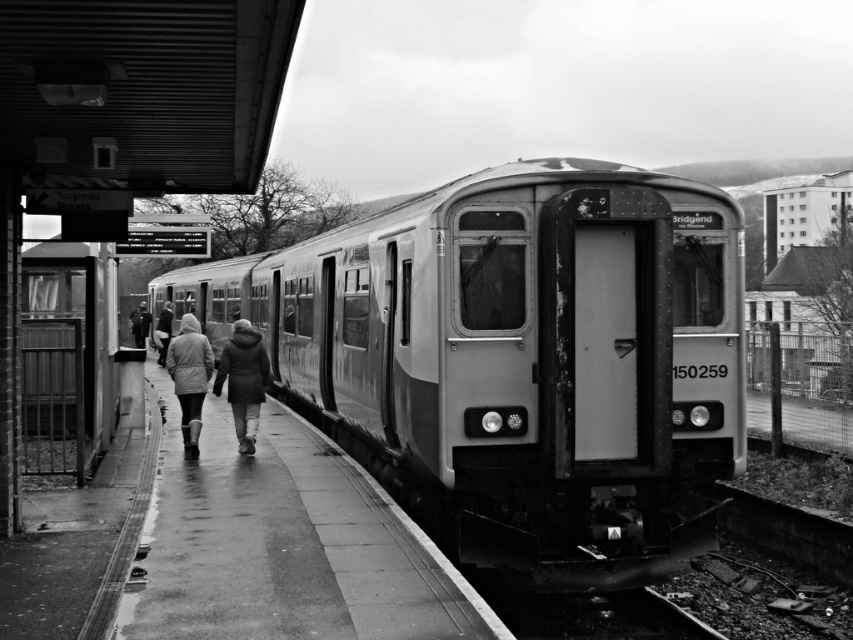
You are standing at the train station platform in the image. There are two points marked on the platform, one at coordinates point (474, 189) and the other at point (227, 381). Which point is closer to you?

Point (474, 189) is closer to the viewer than point (227, 381).

You are standing on the platform at the train station. You see the metallic gray train at center and the dark gray coat at center. Which object is higher from the ground?

The metallic gray train at center is higher from the ground than the dark gray coat at center.

You are standing at the train station and want to board the metallic gray train at center. The dark gray jacket at center is blocking your path. Can you walk around them to reach the train?

The metallic gray train at center is closer to the viewer than the dark gray jacket at center, so you can walk around the dark gray jacket at center to reach the train since it is farther away from you.